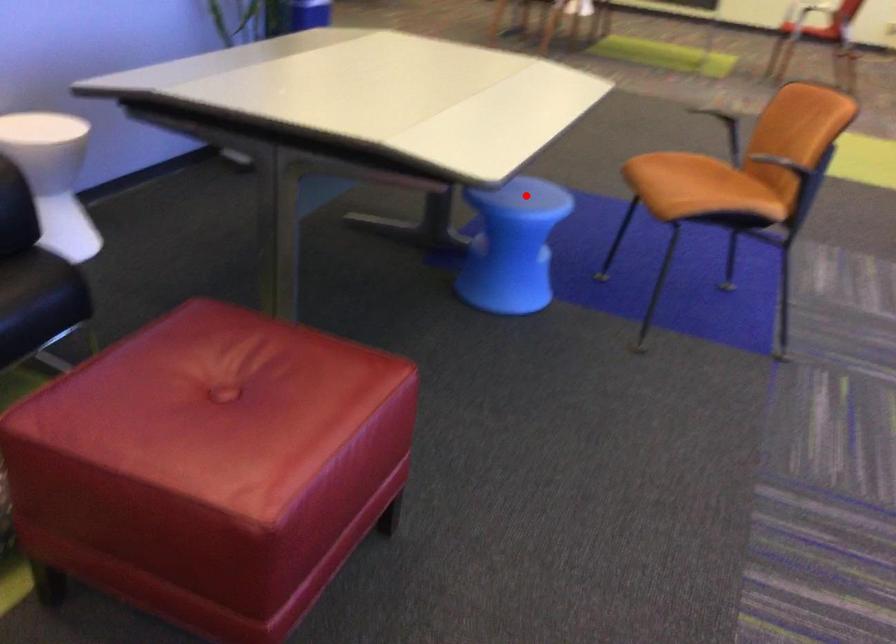
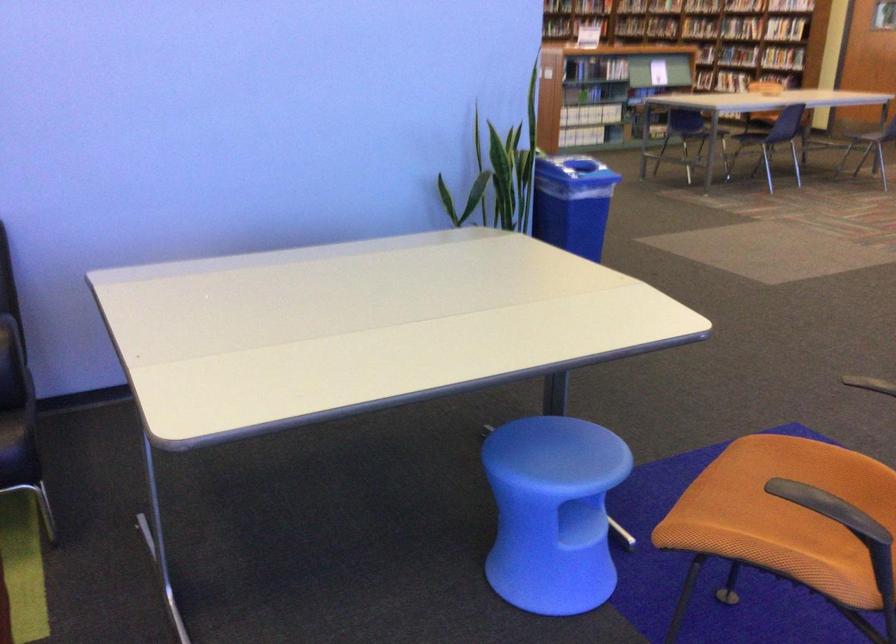
Question: I am providing you with two images of the same scene from different viewpoints. Image1 has a red point marked. In image2, the corresponding 3D location appears at what relative position? Reply with the corresponding letter.

Choices:
 (A) Closer
 (B) Farther

Answer: (A)